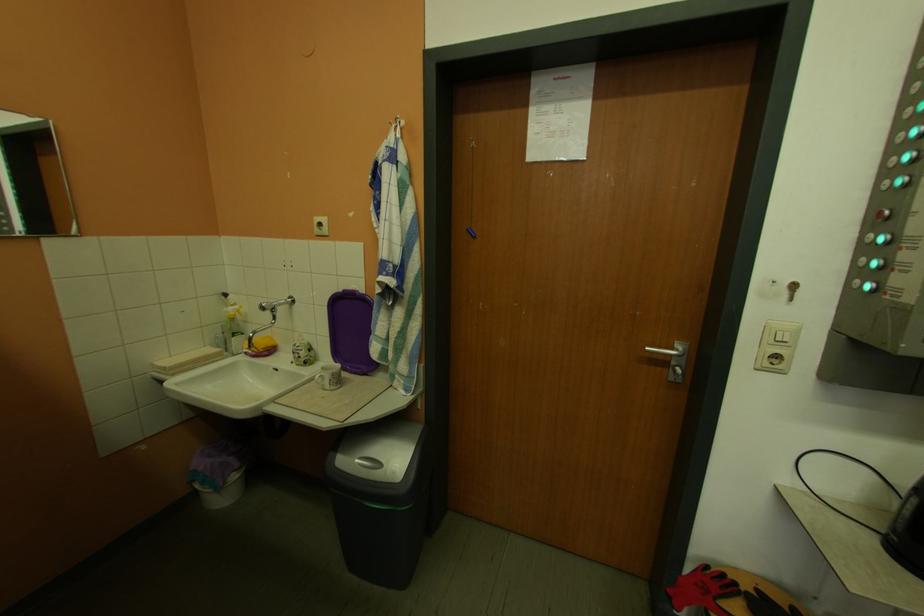
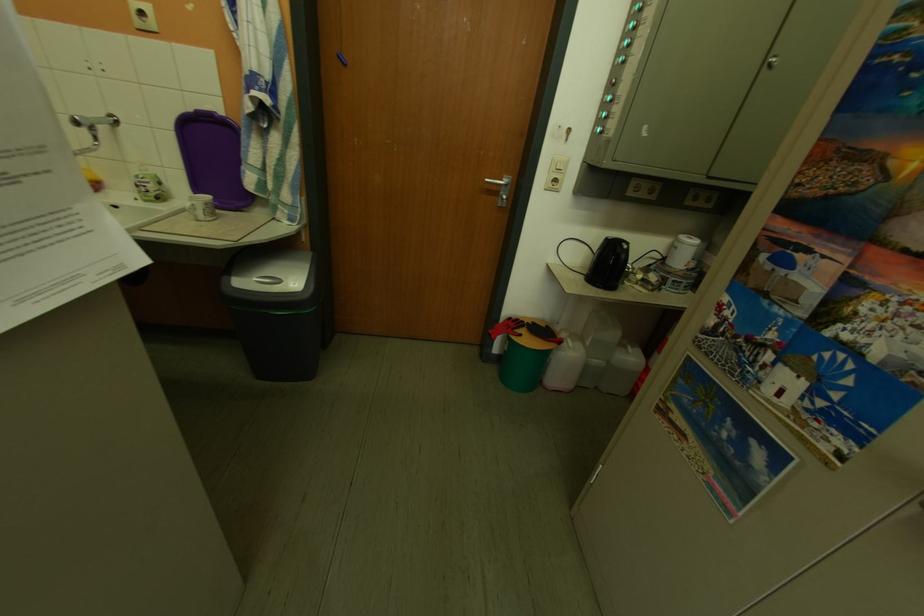
Where in the second image is the point corresponding to the point at 894,535 from the first image?

(599, 277)